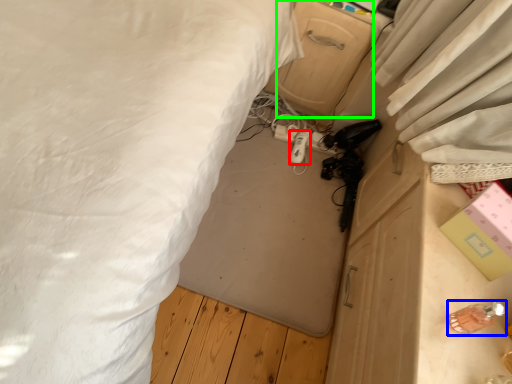
Question: Considering the real-world distances, which object is farthest from equipment (highlighted by a red box)? equipment (highlighted by a blue box) or drawer (highlighted by a green box)?

Choices:
 (A) equipment
 (B) drawer

Answer: (A)